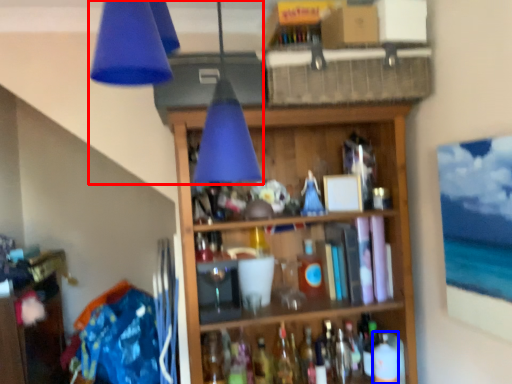
Question: Which of the following is the closest to the observer, lamp (highlighted by a red box) or bottle (highlighted by a blue box)?

Choices:
 (A) lamp
 (B) bottle

Answer: (A)